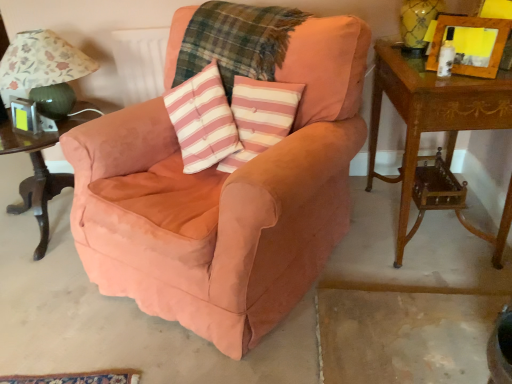
Question: Looking at their shapes, would you say wooden carved side table at right, the first table viewed from the right, is wider or thinner than metallic silver picture frame at left, which appears as the second picture frame when viewed from the top?

Choices:
 (A) wide
 (B) thin

Answer: (A)

Question: From the image's perspective, relative to metallic silver picture frame at left, acting as the second picture frame starting from the front, is wooden carved side table at right, the first table viewed from the right, above or below?

Choices:
 (A) below
 (B) above

Answer: (A)

Question: Which of these objects is positioned farthest from the floral fabric lampshade at left?

Choices:
 (A) dark wood table at left, arranged as the second table when viewed from the right
 (B) suede-like peach armchair at center
 (C) pink striped fabric pillow at center
 (D) plaid fabric at center
 (E) wooden carved side table at right, the first table viewed from the right

Answer: (E)

Question: Estimate the real-world distances between objects in this image. Which object is closer to the wooden picture frame at upper right, which appears as the 2th picture frame when viewed from the back?

Choices:
 (A) wooden carved side table at right, arranged as the 2th table when viewed from the left
 (B) pink striped fabric pillow at center
 (C) floral fabric lampshade at left
 (D) dark wood table at left, which ranks as the 1th table in left-to-right order
 (E) suede-like peach armchair at center

Answer: (A)